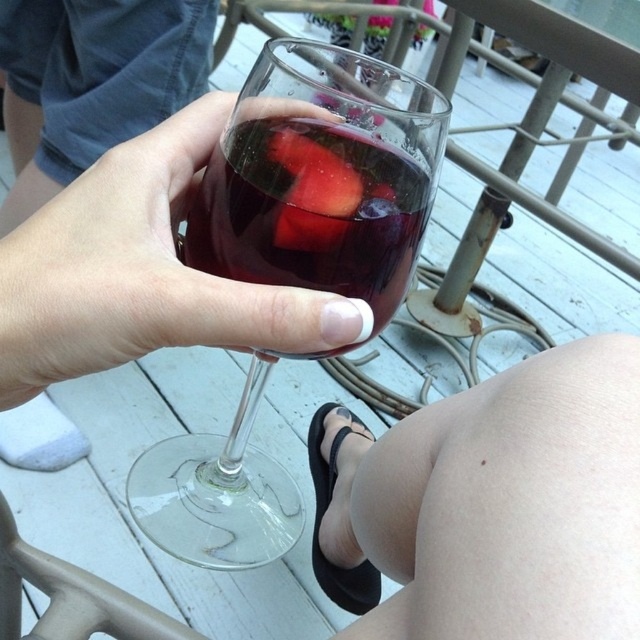
Between smooth skin at lower right and transparent glass at center, which one is positioned higher?

Positioned higher is transparent glass at center.

Does point (536, 548) lie behind point (259, 154)?

No.

The image size is (640, 640). I want to click on smooth skin at lower right, so click(500, 502).

Which is more to the left, smooth skin at lower right or watermelon flesh at center?

watermelon flesh at center

Between point (369, 620) and point (275, 237), which one is positioned in front?

Positioned in front is point (369, 620).

Which is behind, point (516, 636) or point (300, 211)?

The point (300, 211) is behind.

I want to click on smooth skin at lower right, so (500, 502).

Can you confirm if matte glass at center is shorter than clear glass wine glass at center?

Indeed, matte glass at center has a lesser height compared to clear glass wine glass at center.

Is matte glass at center thinner than clear glass wine glass at center?

Indeed, matte glass at center has a lesser width compared to clear glass wine glass at center.

Does point (8, 404) lie in front of point (125, 45)?

Yes, it is in front of point (125, 45).

I want to click on matte glass at center, so click(140, 272).